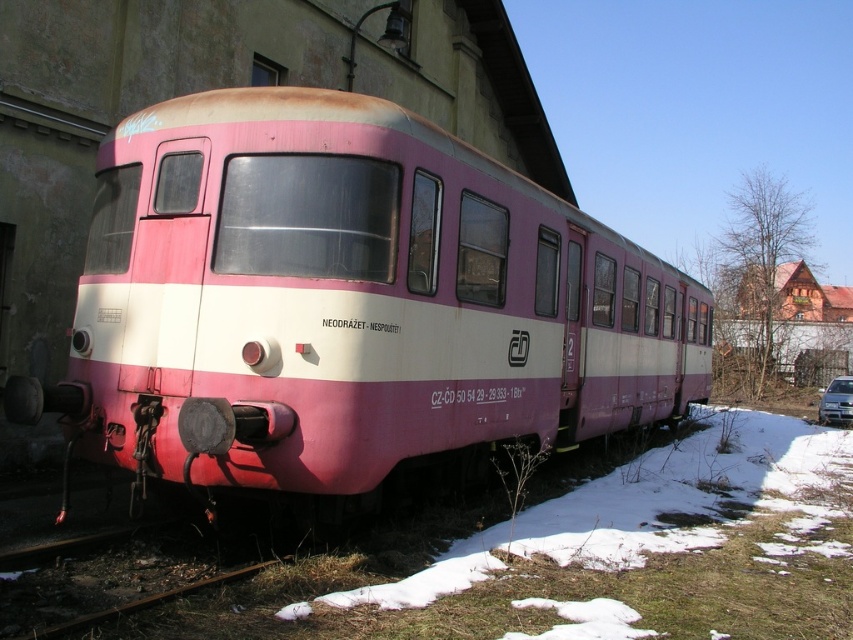
Question: Does pink matte train at center have a smaller size compared to metallic silver car at lower right?

Choices:
 (A) yes
 (B) no

Answer: (B)

Question: Which point is closer to the camera taking this photo?

Choices:
 (A) (361, 486)
 (B) (834, 396)

Answer: (A)

Question: Is pink matte train at center further to camera compared to metallic silver car at lower right?

Choices:
 (A) no
 (B) yes

Answer: (A)

Question: Is pink matte train at center in front of metallic silver car at lower right?

Choices:
 (A) no
 (B) yes

Answer: (B)

Question: Which of the following is the farthest from the observer?

Choices:
 (A) metallic silver car at lower right
 (B) pink matte train at center

Answer: (A)